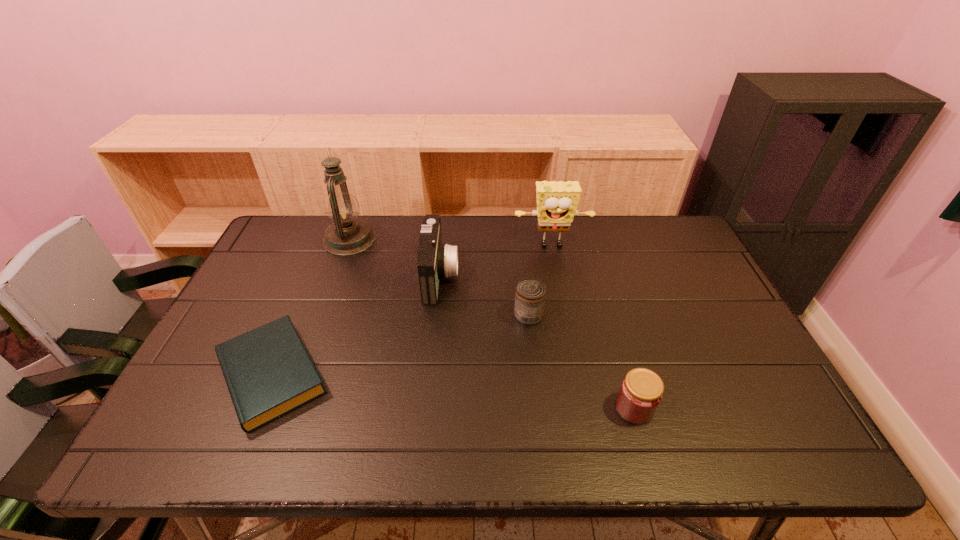
You are a GUI agent. You are given a task and a screenshot of the screen. Output one action in this format:
    pyautogui.click(x=<x>, y=<y>)
    Task: Click on the free space at the far edge of the desktop
    This screenshot has height=540, width=960.
    Given the screenshot: What is the action you would take?
    pyautogui.click(x=389, y=246)

Locate an element on the screen. The width and height of the screenshot is (960, 540). vacant space at the left edge is located at coordinates (252, 320).

The height and width of the screenshot is (540, 960). I want to click on vacant space at the right edge, so click(x=694, y=287).

This screenshot has height=540, width=960. I want to click on free space at the near right corner of the desktop, so click(x=739, y=426).

I want to click on empty location between the can and the shortest object, so click(x=400, y=345).

Find the location of a particular element. vacant space that is in between the second tallest object and the tallest object is located at coordinates (450, 243).

This screenshot has height=540, width=960. In order to click on free space that is in between the sponge and the oil lamp in this screenshot , I will do `click(450, 243)`.

Where is `vacant area that lies between the shortest object and the jam`? This screenshot has height=540, width=960. vacant area that lies between the shortest object and the jam is located at coordinates (453, 391).

Find the location of a particular element. free spot between the shortest object and the jam is located at coordinates (453, 391).

Identify the location of free space between the can and the jam. (582, 362).